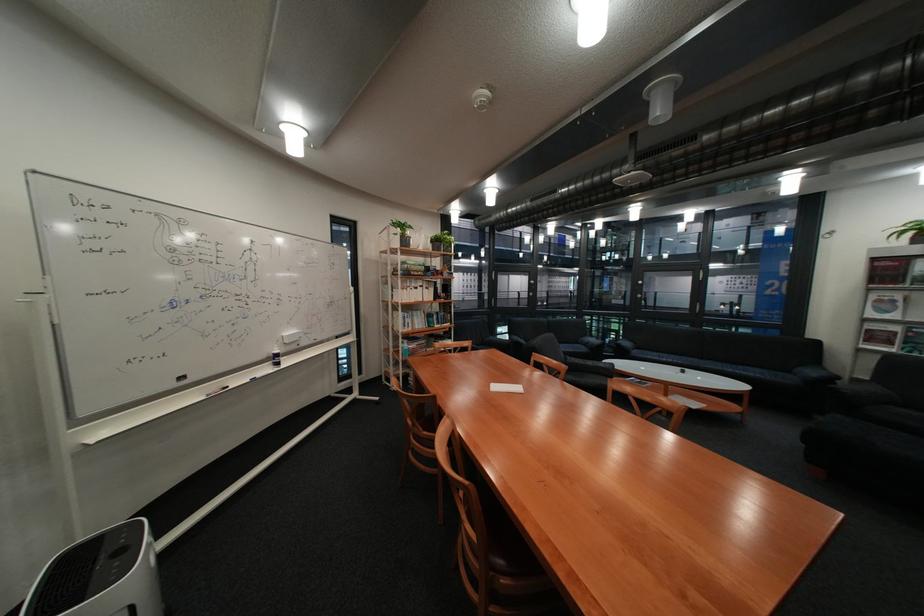
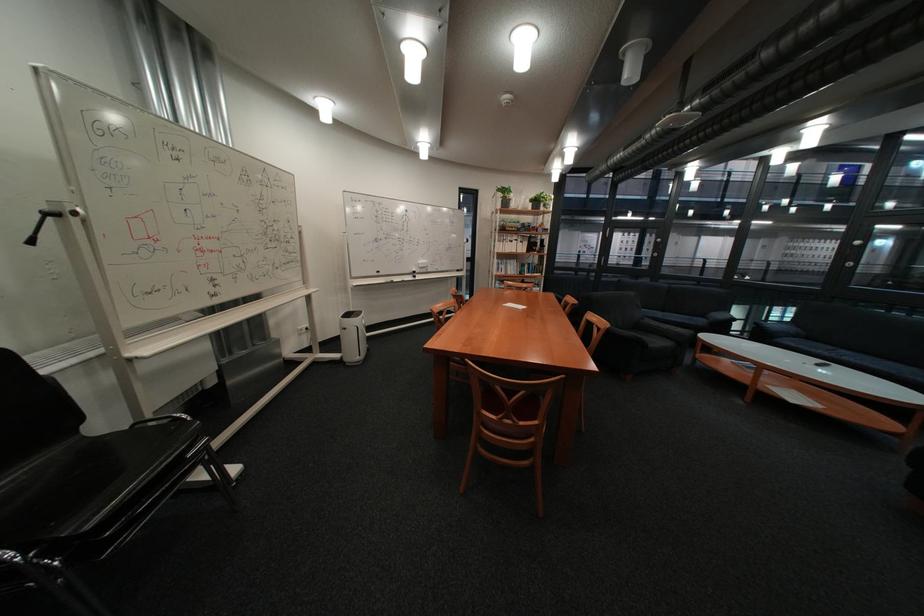
Locate, in the second image, the point that corresponds to [659,357] in the first image.

(808, 345)